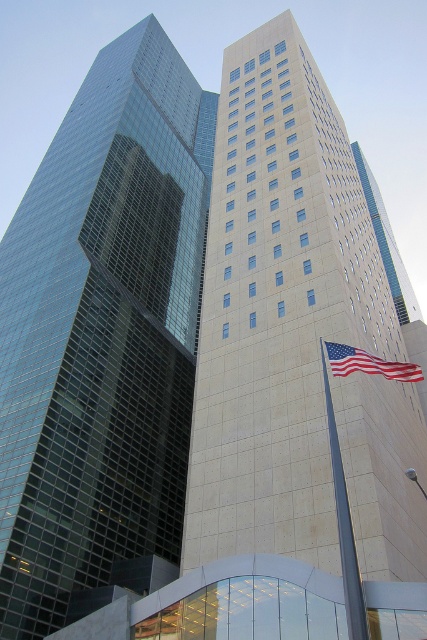
Locate an element on the screen. The height and width of the screenshot is (640, 427). glassy reflective skyscraper at left is located at coordinates (102, 332).

Who is more forward, (85, 356) or (389, 284)?

Point (85, 356)

Where is `glassy reflective skyscraper at left`? glassy reflective skyscraper at left is located at coordinates (102, 332).

Between glassy reflective skyscraper at left and american flag at right, which one appears on the left side from the viewer's perspective?

glassy reflective skyscraper at left

Is glassy reflective skyscraper at left above american flag at right?

Indeed, glassy reflective skyscraper at left is positioned over american flag at right.

Describe the element at coordinates (102, 332) in the screenshot. The height and width of the screenshot is (640, 427). I see `glassy reflective skyscraper at left` at that location.

I want to click on glassy reflective skyscraper at left, so click(x=102, y=332).

Which is above, white stone building at center or american flag at right?

white stone building at center is higher up.

From the picture: Can you confirm if white stone building at center is positioned above american flag at right?

Correct, white stone building at center is located above american flag at right.

What do you see at coordinates (394, 273) in the screenshot? I see `white stone building at center` at bounding box center [394, 273].

Identify the location of white stone building at center. (394, 273).